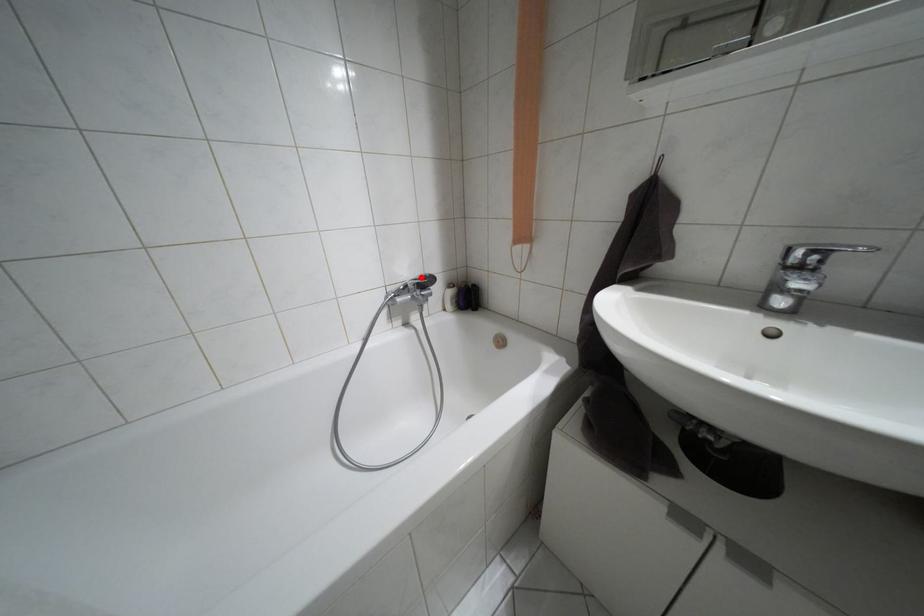
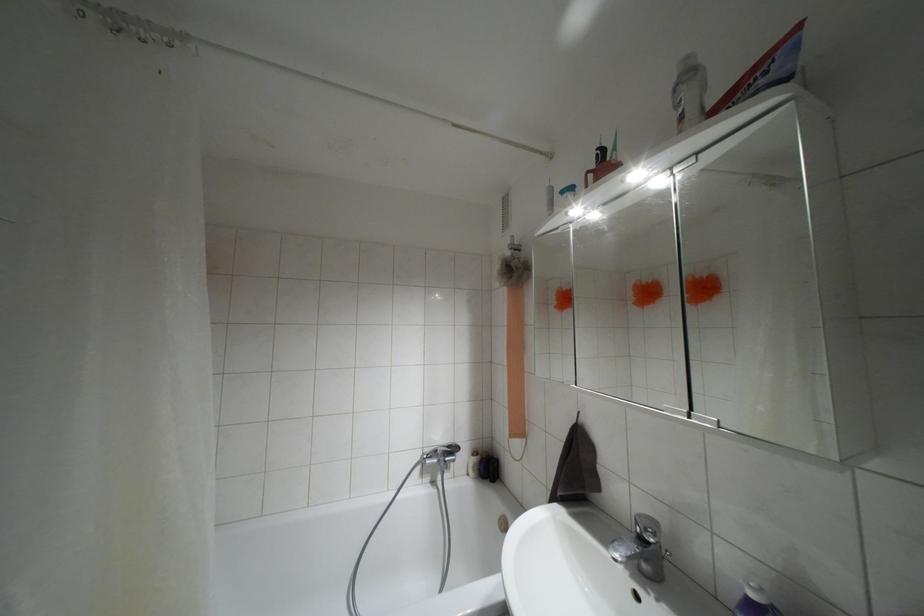
Question: I am providing you with two images of the same scene from different viewpoints. Given a red point in image1, look at the same physical point in image2. Is it:

Choices:
 (A) Closer to the viewpoint
 (B) Farther from the viewpoint

Answer: (B)